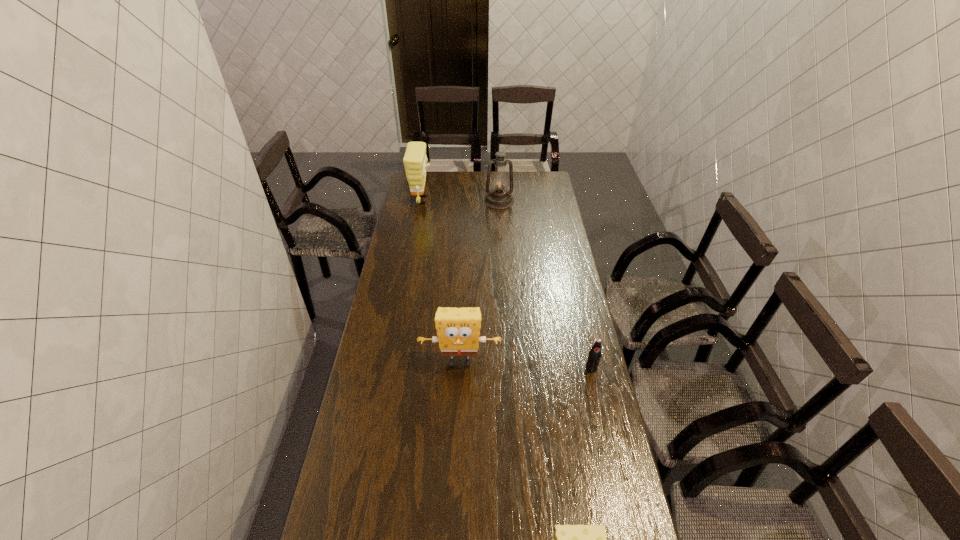
Where is `empty space that is in between the shortest object and the oil lamp`? empty space that is in between the shortest object and the oil lamp is located at coordinates point(545,284).

Where is `vacant area between the tallest sponge and the oil lamp`? The height and width of the screenshot is (540, 960). vacant area between the tallest sponge and the oil lamp is located at coordinates (461, 200).

Locate an element on the screen. This screenshot has width=960, height=540. free spot between the oil lamp and the second farthest sponge is located at coordinates (480, 281).

Identify the location of free area in between the leftmost sponge and the second farthest sponge. (441, 281).

Locate an element on the screen. Image resolution: width=960 pixels, height=540 pixels. unoccupied position between the second farthest sponge and the farthest sponge is located at coordinates (441, 281).

Find the location of a particular element. unoccupied position between the third shortest object and the rightmost object is located at coordinates (526, 365).

Where is `unoccupied position between the leftmost object and the rightmost object`? This screenshot has width=960, height=540. unoccupied position between the leftmost object and the rightmost object is located at coordinates (507, 284).

Where is `the closest object to the second sponge from right to left`? This screenshot has width=960, height=540. the closest object to the second sponge from right to left is located at coordinates (594, 356).

In order to click on object that is the second nearest to the oil lamp in this screenshot , I will do `click(458, 329)`.

Locate an element on the screen. The width and height of the screenshot is (960, 540). sponge that is the second closest one to the oil lamp is located at coordinates (458, 329).